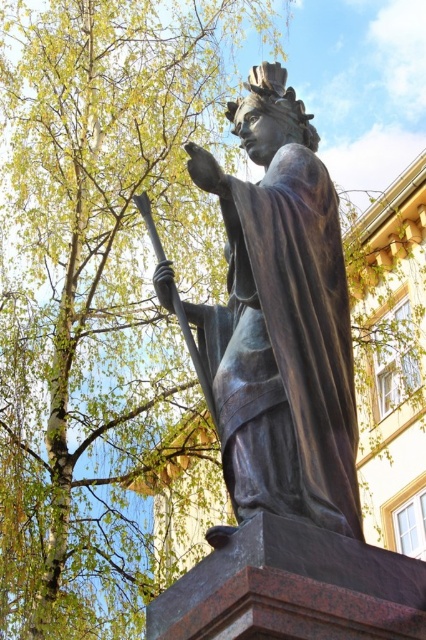
Question: Which object appears closest to the camera in this image?

Choices:
 (A) shiny bronze statue at center
 (B) green leafy tree at upper left

Answer: (A)

Question: Which object is farther from the camera taking this photo?

Choices:
 (A) shiny bronze statue at center
 (B) green leafy tree at upper left

Answer: (B)

Question: Is green leafy tree at upper left smaller than shiny bronze statue at center?

Choices:
 (A) yes
 (B) no

Answer: (B)

Question: From the image, what is the correct spatial relationship of green leafy tree at upper left in relation to shiny bronze statue at center?

Choices:
 (A) right
 (B) left

Answer: (B)

Question: Can you confirm if green leafy tree at upper left is positioned to the right of shiny bronze statue at center?

Choices:
 (A) no
 (B) yes

Answer: (A)